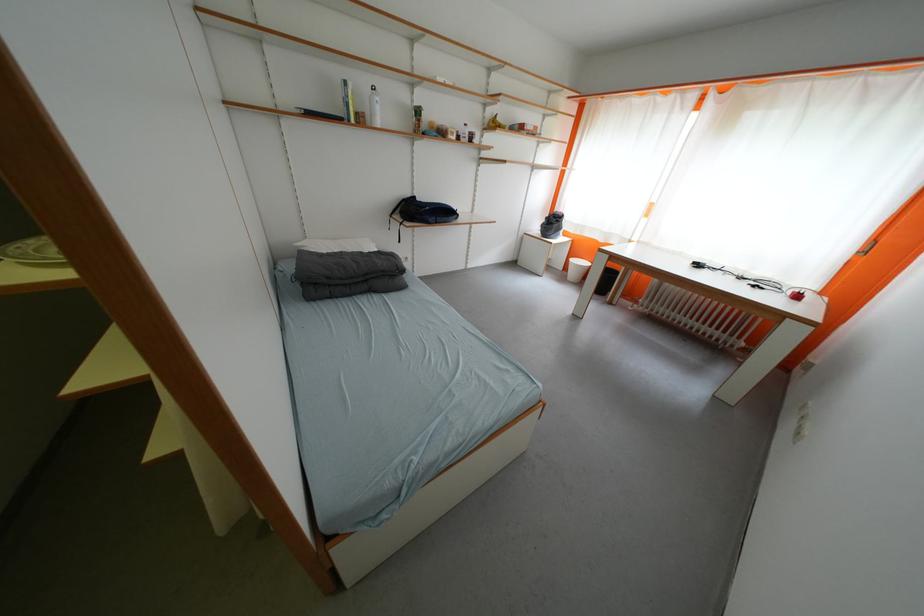
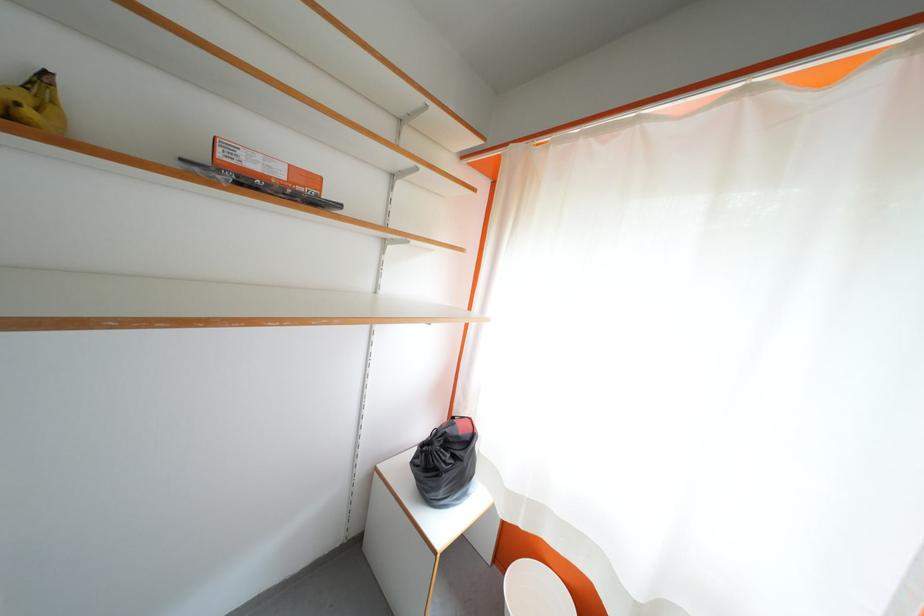
Where in the second image is the point corresponding to point 562,225 from the first image?

(455, 460)